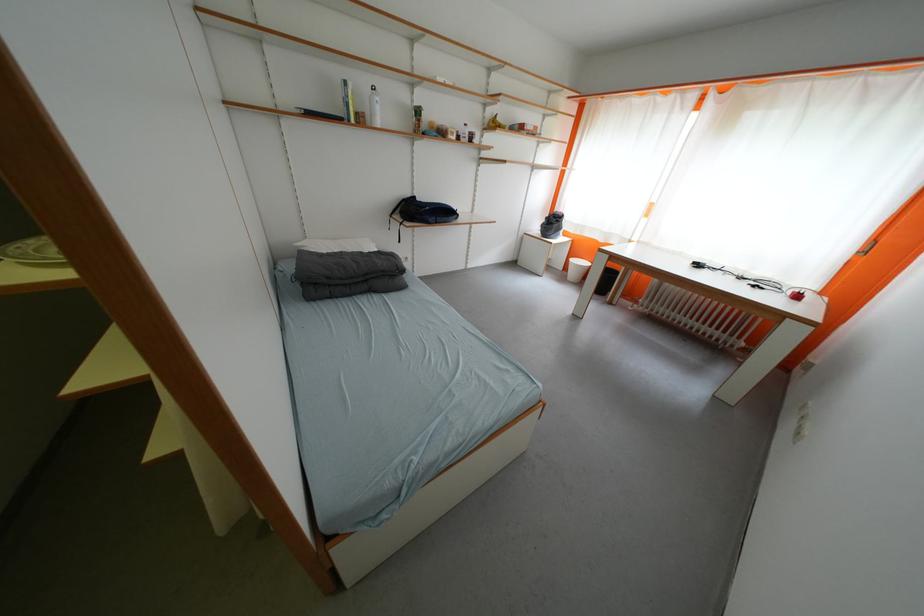
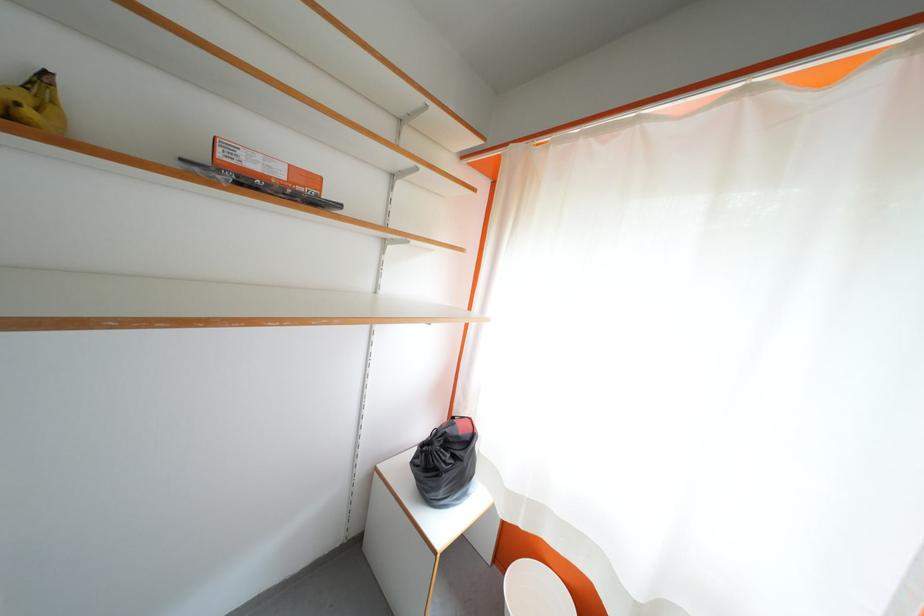
Where in the second image is the point corresponding to point 562,225 from the first image?

(455, 460)